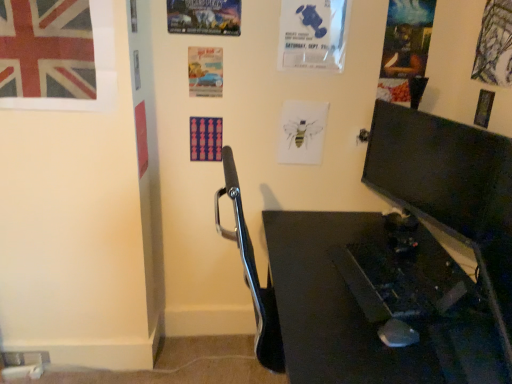
Question: Can you confirm if watercolor bee at center, which is the third poster page in left-to-right order, is taller than matte black monitor at right?

Choices:
 (A) yes
 (B) no

Answer: (B)

Question: From the image's perspective, is watercolor bee at center, the fourth poster page positioned from the right, on matte black monitor at right?

Choices:
 (A) yes
 (B) no

Answer: (A)

Question: Is watercolor bee at center, which is the third poster page in left-to-right order, touching matte black monitor at right?

Choices:
 (A) no
 (B) yes

Answer: (A)

Question: Does watercolor bee at center, the fourth poster page positioned from the right, appear on the right side of matte black monitor at right?

Choices:
 (A) yes
 (B) no

Answer: (B)

Question: Is watercolor bee at center, which is the third poster page in left-to-right order, thinner than matte black monitor at right?

Choices:
 (A) yes
 (B) no

Answer: (A)

Question: Does watercolor bee at center, the fourth poster page positioned from the right, lie in front of matte black monitor at right?

Choices:
 (A) no
 (B) yes

Answer: (A)

Question: Considering the relative sizes of blue paper poster at upper center, which is the 4th poster page from left to right, and watercolor bee at center, the fourth poster page positioned from the right, in the image provided, is blue paper poster at upper center, which is the 4th poster page from left to right, shorter than watercolor bee at center, the fourth poster page positioned from the right,?

Choices:
 (A) yes
 (B) no

Answer: (B)

Question: Considering the relative positions of blue paper poster at upper center, which is the 4th poster page from left to right, and watercolor bee at center, which is the third poster page in left-to-right order, in the image provided, is blue paper poster at upper center, which is the 4th poster page from left to right, to the right of watercolor bee at center, which is the third poster page in left-to-right order, from the viewer's perspective?

Choices:
 (A) no
 (B) yes

Answer: (B)

Question: From a real-world perspective, is blue paper poster at upper center, positioned as the third poster page in right-to-left order, under watercolor bee at center, which is the third poster page in left-to-right order?

Choices:
 (A) no
 (B) yes

Answer: (A)

Question: From a real-world perspective, is blue paper poster at upper center, which is the 4th poster page from left to right, physically above watercolor bee at center, which is the third poster page in left-to-right order?

Choices:
 (A) yes
 (B) no

Answer: (A)

Question: Does blue paper poster at upper center, which is the 4th poster page from left to right, touch watercolor bee at center, the fourth poster page positioned from the right?

Choices:
 (A) no
 (B) yes

Answer: (A)

Question: Considering the relative sizes of blue paper poster at upper center, positioned as the third poster page in right-to-left order, and watercolor bee at center, which is the third poster page in left-to-right order, in the image provided, is blue paper poster at upper center, positioned as the third poster page in right-to-left order, smaller than watercolor bee at center, which is the third poster page in left-to-right order,?

Choices:
 (A) no
 (B) yes

Answer: (A)

Question: Is watercolor bee at center, which is the third poster page in left-to-right order, outside of black glossy desk at lower right?

Choices:
 (A) no
 (B) yes

Answer: (B)